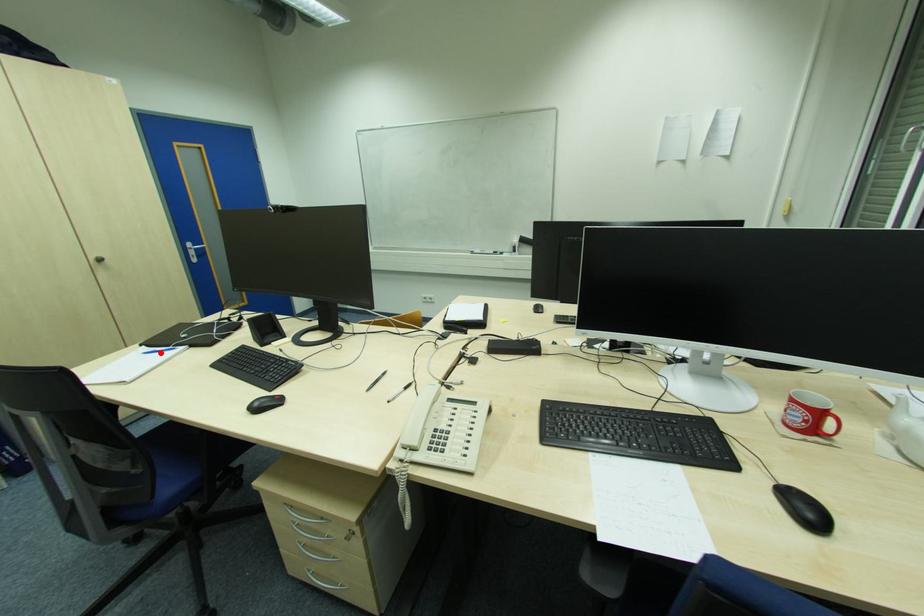
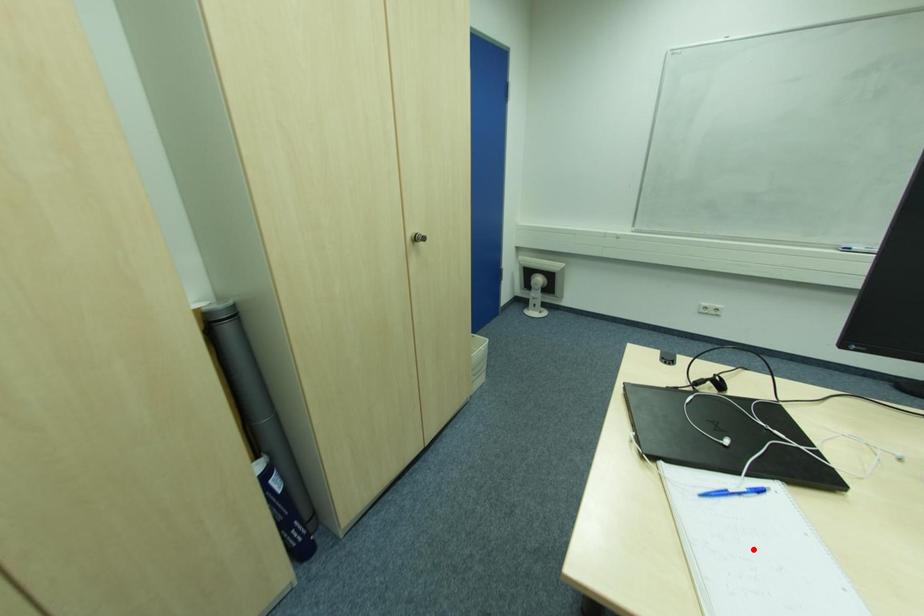
In the scene shown: I am providing you with two images of the same scene from different viewpoints. A red point is marked on the first image and another point is marked on the second image. Is the red point in image1 aligned with the point shown in image2?

No